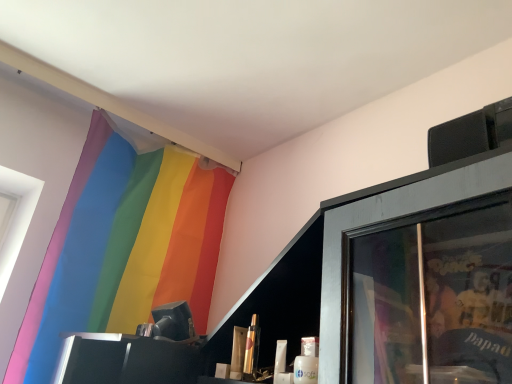
Question: Relative to metallic gold lipstick at center, the 2th toiletry in the left-to-right sequence, is rainbow fabric curtain at upper left in front or behind?

Choices:
 (A) front
 (B) behind

Answer: (B)

Question: In terms of height, does rainbow fabric curtain at upper left look taller or shorter compared to metallic gold lipstick at center, marked as the 1th toiletry in a right-to-left arrangement?

Choices:
 (A) tall
 (B) short

Answer: (A)

Question: Estimate the real-world distances between objects in this image. Which object is farther from the metallic gold lipstick at center, positioned as the second toiletry in right-to-left order?

Choices:
 (A) metallic gold lipstick at center, marked as the 1th toiletry in a right-to-left arrangement
 (B) rainbow fabric curtain at upper left

Answer: (B)

Question: Which object is the closest to the metallic gold lipstick at center, positioned as the second toiletry in right-to-left order?

Choices:
 (A) rainbow fabric curtain at upper left
 (B) metallic gold lipstick at center, marked as the 1th toiletry in a right-to-left arrangement

Answer: (B)